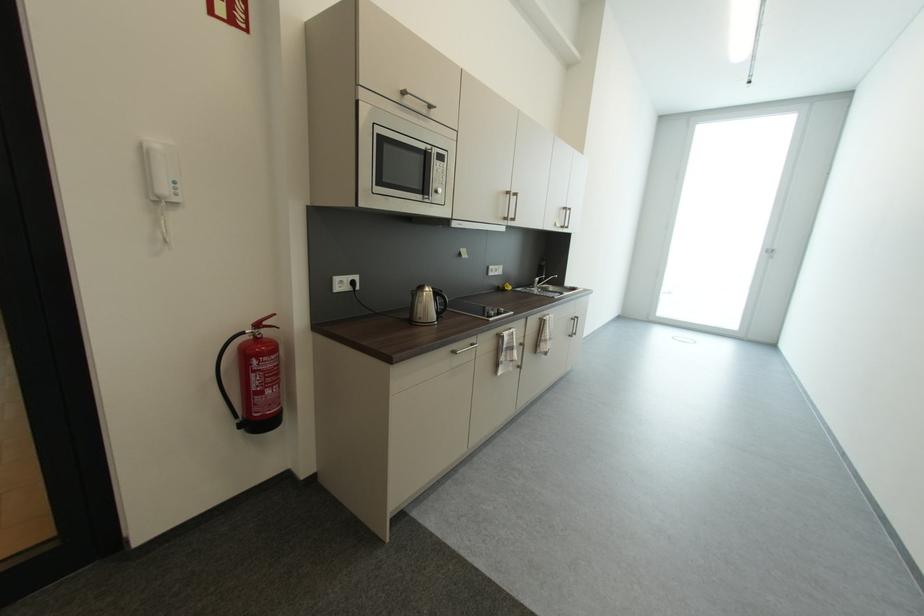
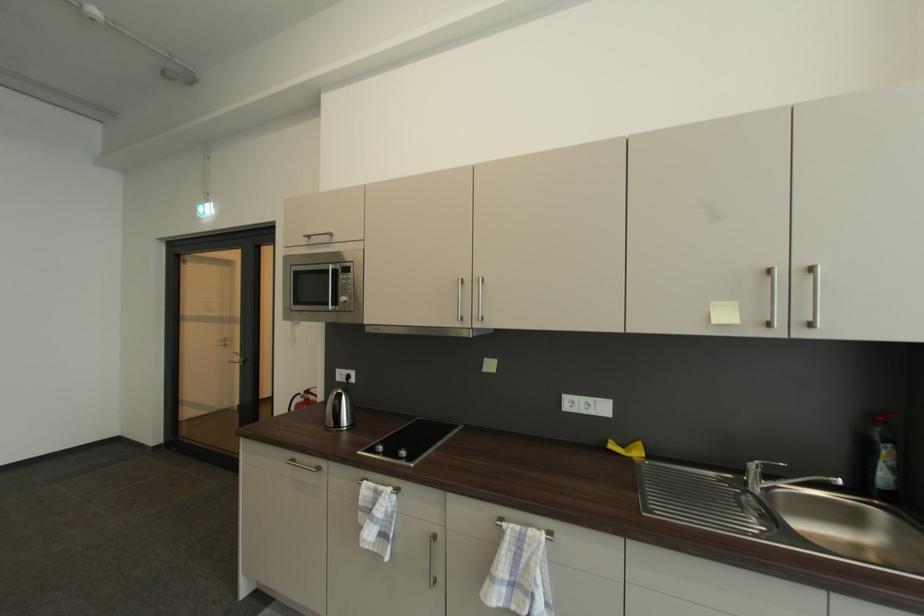
Locate, in the second image, the point that corresponds to point (552, 321) in the first image.

(507, 529)